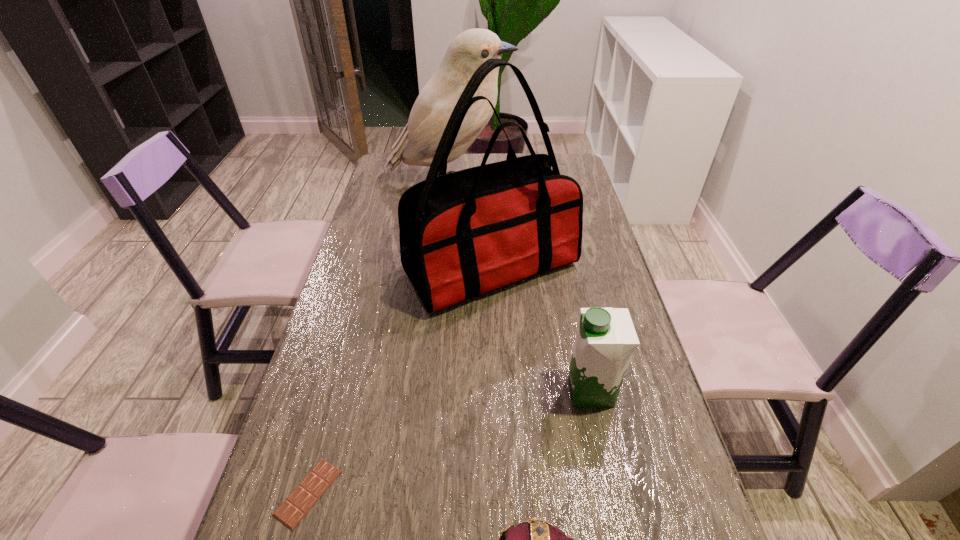
Locate an element on the screen. The height and width of the screenshot is (540, 960). vacant space located 0.050m on the back of the shortest object is located at coordinates (324, 435).

Identify the location of object at the far edge. Image resolution: width=960 pixels, height=540 pixels. (417, 144).

At what (x,y) coordinates should I click in order to perform the action: click on parakeet that is positioned at the left edge. Please return your answer as a coordinate pair (x, y). The image size is (960, 540). Looking at the image, I should click on (417, 144).

Find the location of `chocolate bar that is at the left edge`. chocolate bar that is at the left edge is located at coordinates (294, 508).

Find the location of a particular element. The height and width of the screenshot is (540, 960). duffel bag located in the right edge section of the desktop is located at coordinates (461, 234).

What are the coordinates of `soya milk that is at the right edge` in the screenshot? It's located at (606, 338).

Identify the location of object at the far left corner. (417, 144).

This screenshot has width=960, height=540. In order to click on free region at the far edge of the desktop in this screenshot , I will do `click(527, 153)`.

Where is `vacant area at the left edge of the desktop`? vacant area at the left edge of the desktop is located at coordinates (376, 384).

At what (x,y) coordinates should I click in order to perform the action: click on free location at the right edge of the desktop. Please return your answer as a coordinate pair (x, y). This screenshot has width=960, height=540. Looking at the image, I should click on (603, 249).